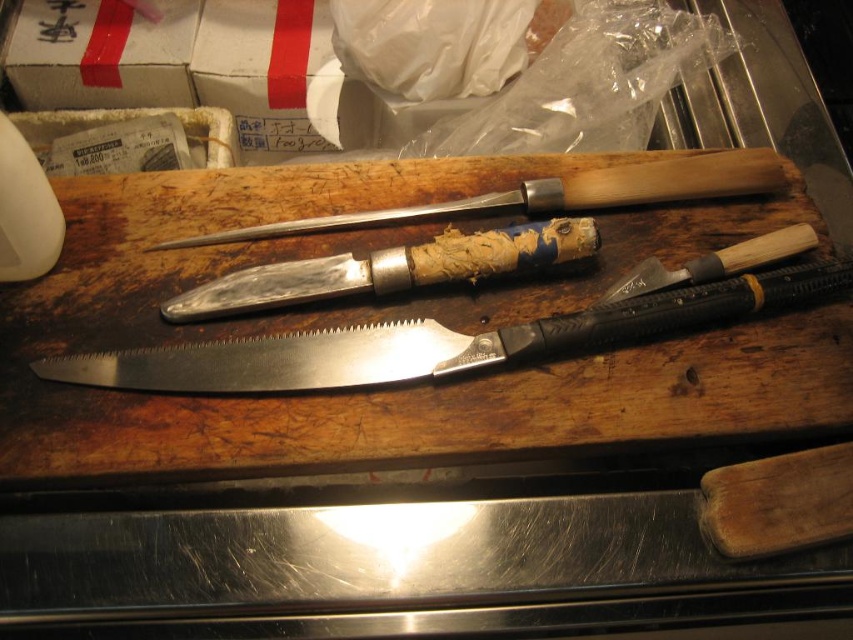
Can you confirm if wooden cutting board at center is positioned to the right of wooden-handled chisel at center?

In fact, wooden cutting board at center is to the left of wooden-handled chisel at center.

Who is more distant from viewer, (438,449) or (730,266)?

The point (730,266) is behind.

You are a GUI agent. You are given a task and a screenshot of the screen. Output one action in this format:
    pyautogui.click(x=<x>, y=<y>)
    Task: Click on the wooden cutting board at center
    This screenshot has height=640, width=853.
    Given the screenshot: What is the action you would take?
    pyautogui.click(x=381, y=317)

The width and height of the screenshot is (853, 640). Find the location of `wooden cutting board at center`. wooden cutting board at center is located at coordinates (381, 317).

Is metallic saw at center shorter than white cardboard box at upper left?

Correct, metallic saw at center is not as tall as white cardboard box at upper left.

I want to click on metallic saw at center, so click(270, 362).

Is white cardboard box at upper left behind polished silver knife at center?

Yes.

Is point (96, 54) positioned in front of point (732, 179)?

No.

Identify the location of white cardboard box at upper left. The width and height of the screenshot is (853, 640). (100, 54).

Locate an element on the screen. This screenshot has width=853, height=640. white cardboard box at upper left is located at coordinates (100, 54).